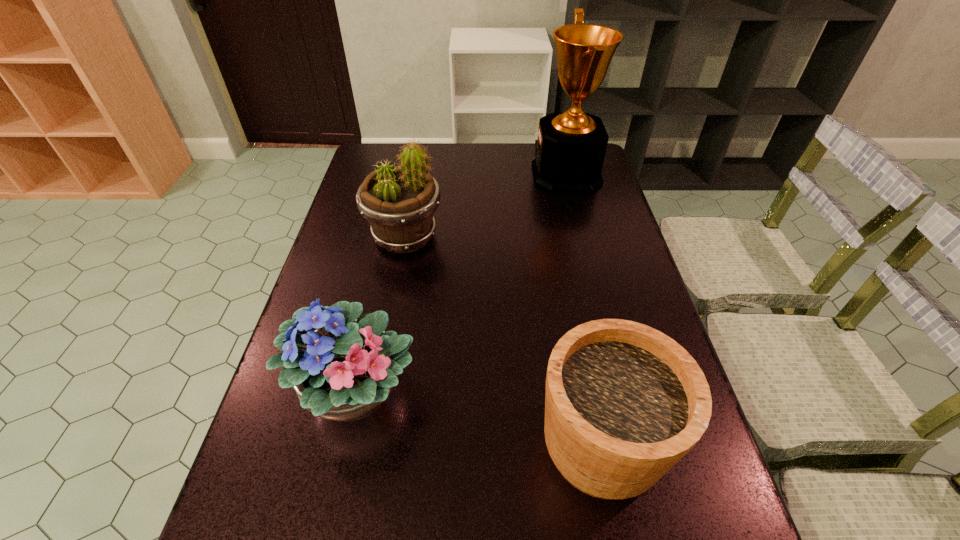
Locate an element on the screen. The height and width of the screenshot is (540, 960). vacant space in between the bouquet and the shorter flowerpot is located at coordinates (478, 418).

Identify which object is located as the second nearest to the trophy cup. Please provide its 2D coordinates. Your answer should be formatted as a tuple, i.e. [(x, y)], where the tuple contains the x and y coordinates of a point satisfying the conditions above.

[(343, 371)]

Identify the location of object that stands as the second closest to the farthest object. (343, 371).

Find the location of a particular element. Image resolution: width=960 pixels, height=540 pixels. free region that satisfies the following two spatial constraints: 1. on the front of the farthest object with the label; 2. on the front side of the farther flowerpot is located at coordinates (582, 237).

The width and height of the screenshot is (960, 540). In order to click on free space that satisfies the following two spatial constraints: 1. on the front of the farthest object with the label; 2. on the front side of the third shortest object in this screenshot , I will do 582,237.

Locate an element on the screen. This screenshot has height=540, width=960. free space in the image that satisfies the following two spatial constraints: 1. on the front of the trophy cup with the label; 2. on the front side of the nearer flowerpot is located at coordinates (635, 445).